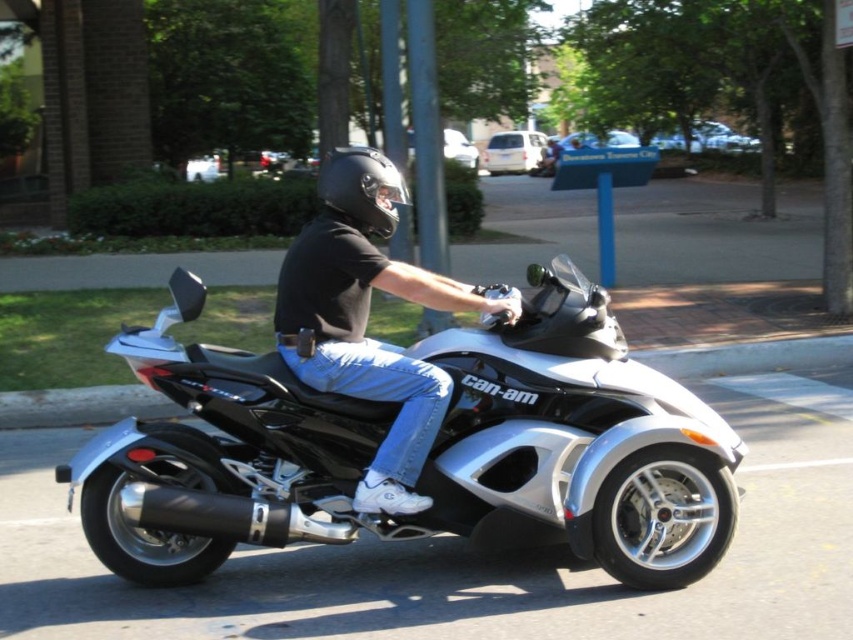
You are a photographer trying to capture the silver metallic trike at center and the matte black helmet at upper center in a single frame. Based on their positions, which object should you focus on first to ensure both are in the shot?

The silver metallic trike at center is positioned on the right side of matte black helmet at upper center, so you should focus on the matte black helmet at upper center first to ensure both are in the shot.